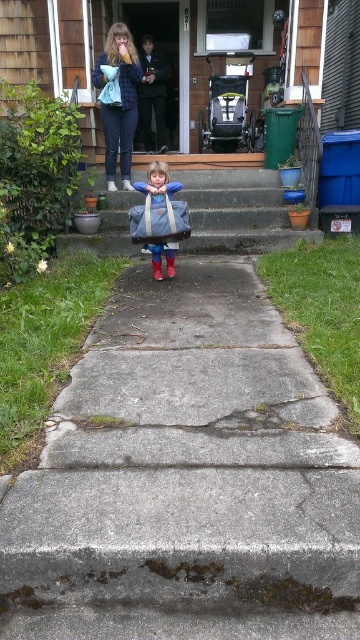
Question: In this image, where is concrete stairs at center located relative to matte blue jacket at upper center?

Choices:
 (A) left
 (B) right

Answer: (B)

Question: Which point appears closest to the camera in this image?

Choices:
 (A) (146, 484)
 (B) (263, 240)
 (C) (177, 188)

Answer: (A)

Question: Is matte blue jacket at upper center above matte blue backpack at center?

Choices:
 (A) yes
 (B) no

Answer: (A)

Question: Can you confirm if matte blue jacket at upper center is positioned below matte blue backpack at center?

Choices:
 (A) yes
 (B) no

Answer: (B)

Question: Estimate the real-world distances between objects in this image. Which object is closer to the matte blue backpack at center?

Choices:
 (A) matte blue jacket at upper center
 (B) concrete stairs at center
 (C) concrete steps at center

Answer: (B)

Question: Which object appears farthest from the camera in this image?

Choices:
 (A) concrete stairs at center
 (B) matte blue jacket at upper center
 (C) concrete steps at center
 (D) matte blue backpack at center

Answer: (B)